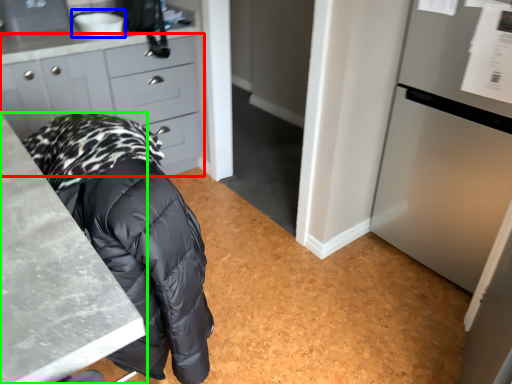
Question: Based on their relative distances, which object is farther from cabinetry (highlighted by a red box)? Choose from sink (highlighted by a blue box) and countertop (highlighted by a green box).

Choices:
 (A) sink
 (B) countertop

Answer: (B)